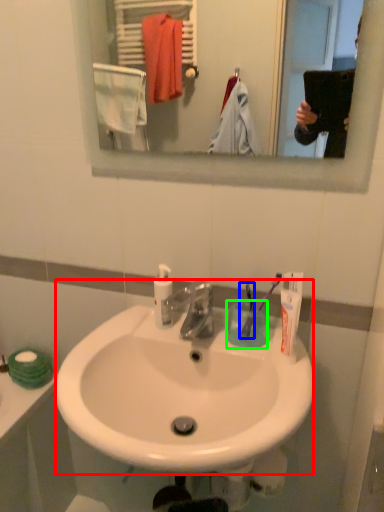
Question: Based on their relative distances, which object is nearer to sink (highlighted by a red box)? Choose from toothbrush (highlighted by a blue box) and coffee cup (highlighted by a green box).

Choices:
 (A) toothbrush
 (B) coffee cup

Answer: (B)